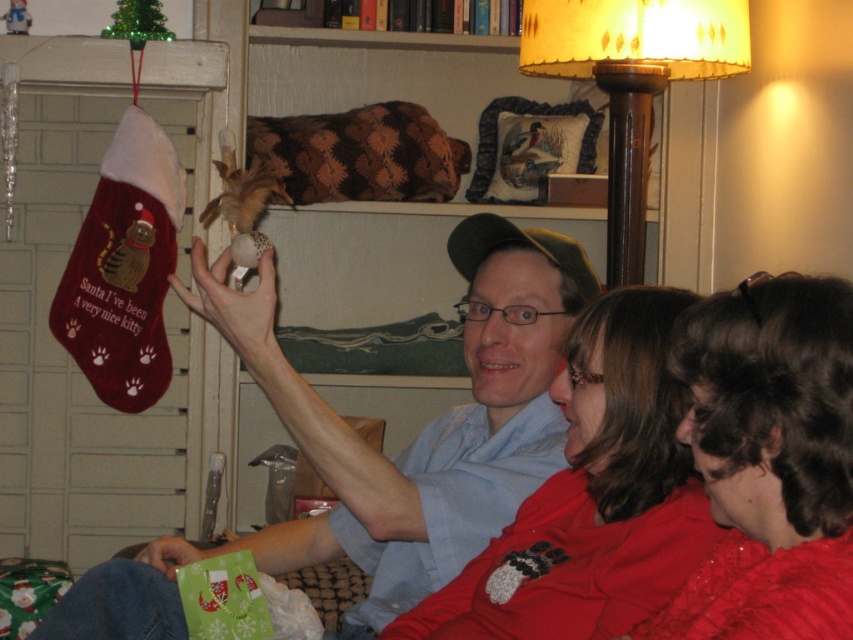
Question: Which point is farther from the camera taking this photo?

Choices:
 (A) (692, 3)
 (B) (850, 611)
 (C) (492, 237)

Answer: (A)

Question: Among these points, which one is nearest to the camera?

Choices:
 (A) (695, 35)
 (B) (492, 492)
 (C) (631, 301)

Answer: (C)

Question: In this image, where is matte red sweater at center located relative to wooden floor lamp at upper right?

Choices:
 (A) above
 (B) below

Answer: (B)

Question: Is matte fabric stocking at left bigger than wooden floor lamp at upper right?

Choices:
 (A) yes
 (B) no

Answer: (A)

Question: Estimate the real-world distances between objects in this image. Which object is farther from the matte fabric stocking at left?

Choices:
 (A) matte red sweater at center
 (B) wooden floor lamp at upper right

Answer: (B)

Question: Does matte fabric stocking at left have a larger size compared to shiny red blouse at lower right?

Choices:
 (A) yes
 (B) no

Answer: (A)